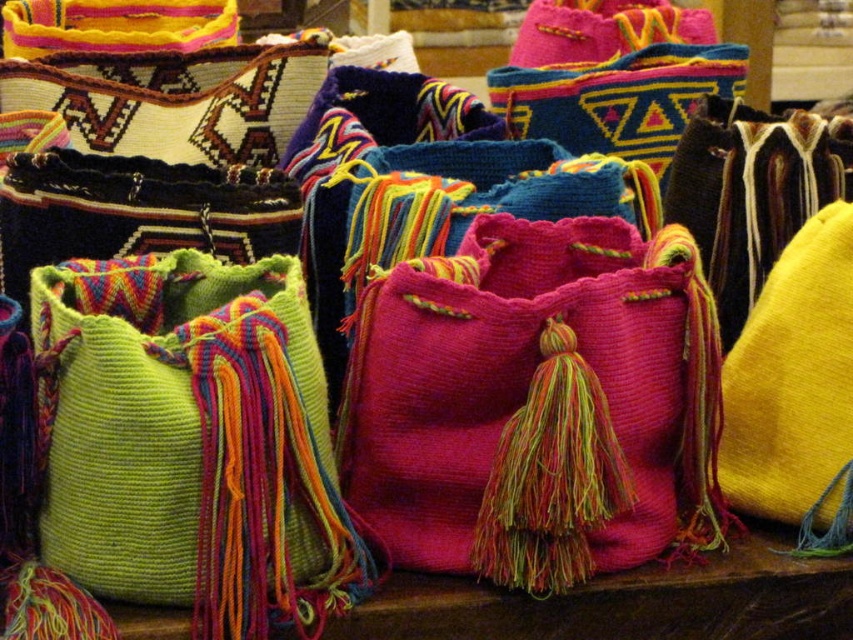
The height and width of the screenshot is (640, 853). I want to click on fuzzy pink bag at center, so click(537, 403).

Is point (476, 508) positioned after point (746, 460)?

No, it is in front of (746, 460).

Who is more distant from viewer, (483, 365) or (843, 397)?

Positioned behind is point (843, 397).

Locate an element on the screen. This screenshot has width=853, height=640. fuzzy pink bag at center is located at coordinates (537, 403).